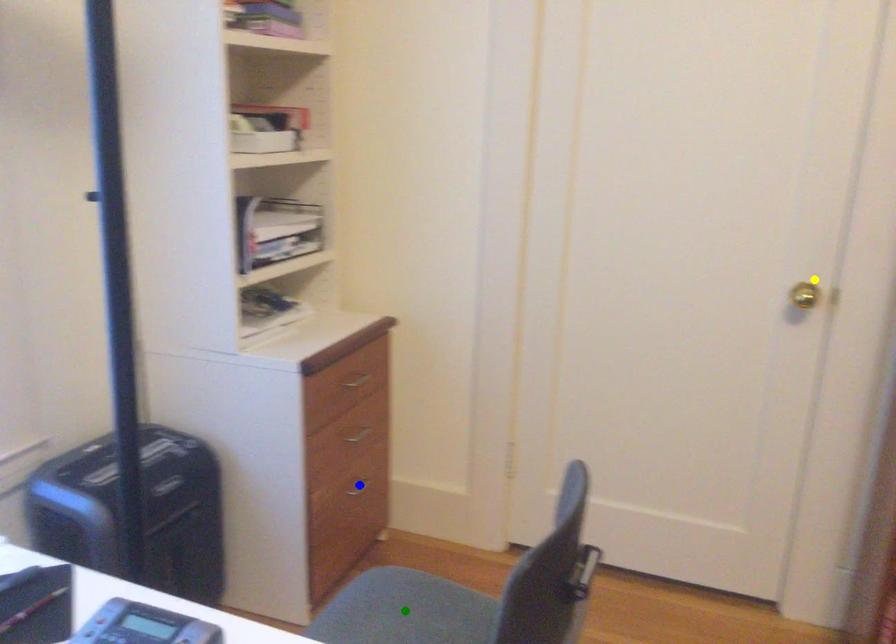
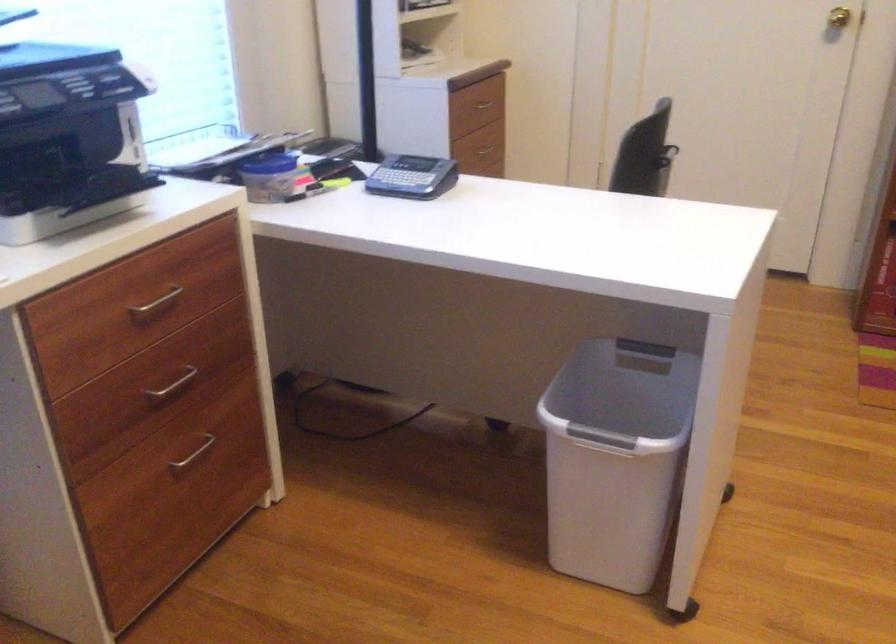
I am providing you with two images of the same scene from different viewpoints. Three points are marked in image1. Which point corresponds to a part or object that is occluded in image2?In image1, three points are marked. Which of them correspond to a part or object that is occluded in image2?Among the three points shown in image1, which one corresponds to a part or object that is no longer visible due to occlusion in image2?

blue point, green point